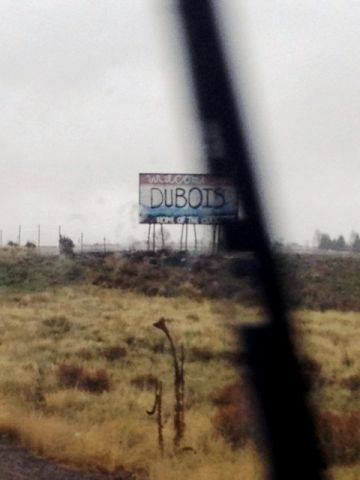
Locate an element on the screen. The height and width of the screenshot is (480, 360). plant is located at coordinates (183, 386), (68, 248), (29, 242), (330, 234).